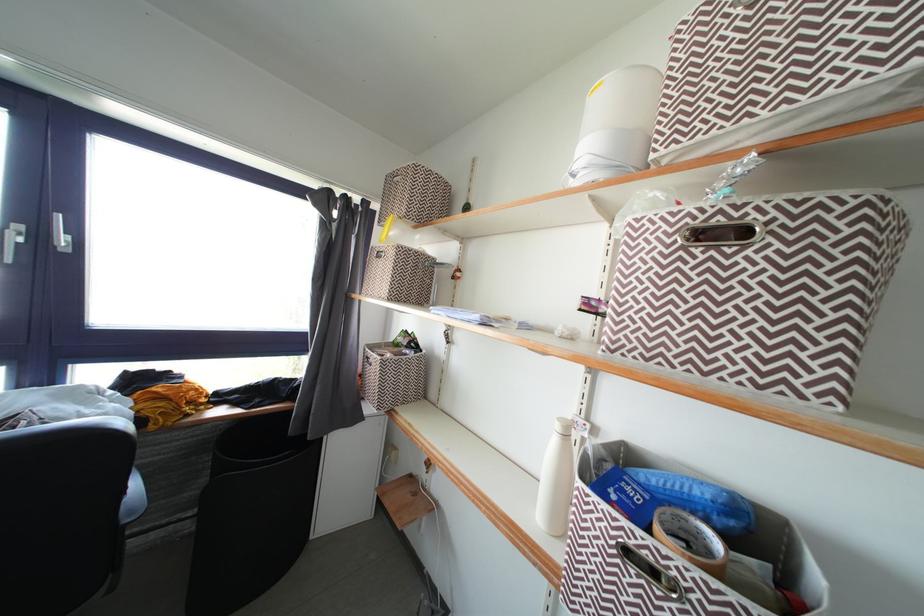
The height and width of the screenshot is (616, 924). What do you see at coordinates (555, 480) in the screenshot?
I see `the white water bottle` at bounding box center [555, 480].